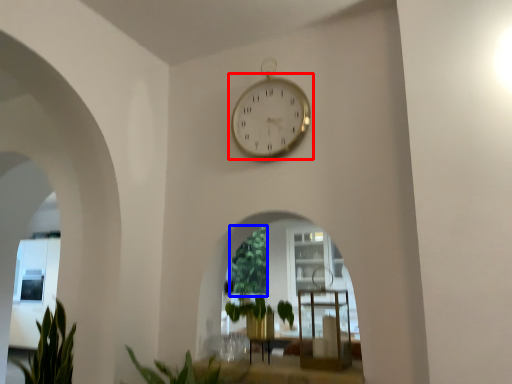
Question: Which point is closer to the camera, wall clock (highlighted by a red box) or vegetation (highlighted by a blue box)?

Choices:
 (A) wall clock
 (B) vegetation

Answer: (A)